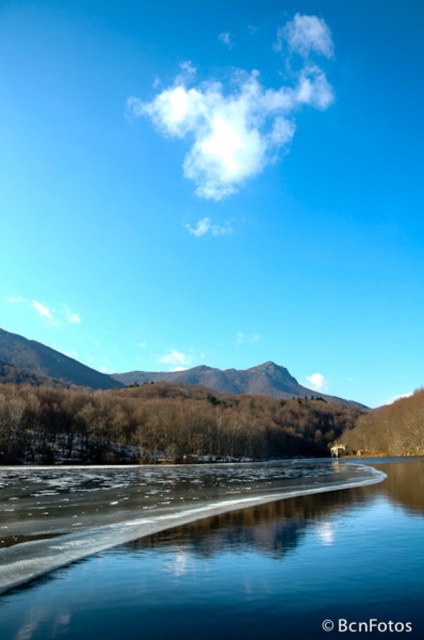
Is point (320, 413) more distant than point (265, 362)?

No, it is in front of (265, 362).

Is brown matte trees at center shorter than brown textured mountain at center?

Yes, brown matte trees at center is shorter than brown textured mountain at center.

Between point (290, 410) and point (58, 376), which one is positioned behind?

The point (58, 376) is behind.

This screenshot has width=424, height=640. Find the location of `brown matte trees at center`. brown matte trees at center is located at coordinates (161, 424).

Is the position of transparent ice at lower center less distant than that of brown textured mountain at center?

Yes, transparent ice at lower center is in front of brown textured mountain at center.

Which of these two, transparent ice at lower center or brown textured mountain at center, stands taller?

brown textured mountain at center

Does point (5, 467) lie behind point (345, 404)?

No, (5, 467) is closer to viewer.

Identify the location of transparent ice at lower center. (212, 550).

Who is shorter, transparent ice at lower center or brown matte trees at center?

transparent ice at lower center is shorter.

Does point (161, 557) come farther from viewer compared to point (74, 397)?

No, (161, 557) is closer to viewer.

Is point (270, 600) closer to camera compared to point (189, 456)?

Yes, it is.

Where is `transparent ice at lower center`? Image resolution: width=424 pixels, height=640 pixels. transparent ice at lower center is located at coordinates (212, 550).